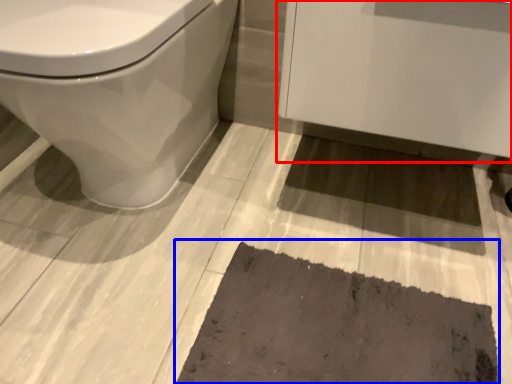
Question: Which object is further to the camera taking this photo, porcelain (highlighted by a red box) or bath mat (highlighted by a blue box)?

Choices:
 (A) porcelain
 (B) bath mat

Answer: (B)